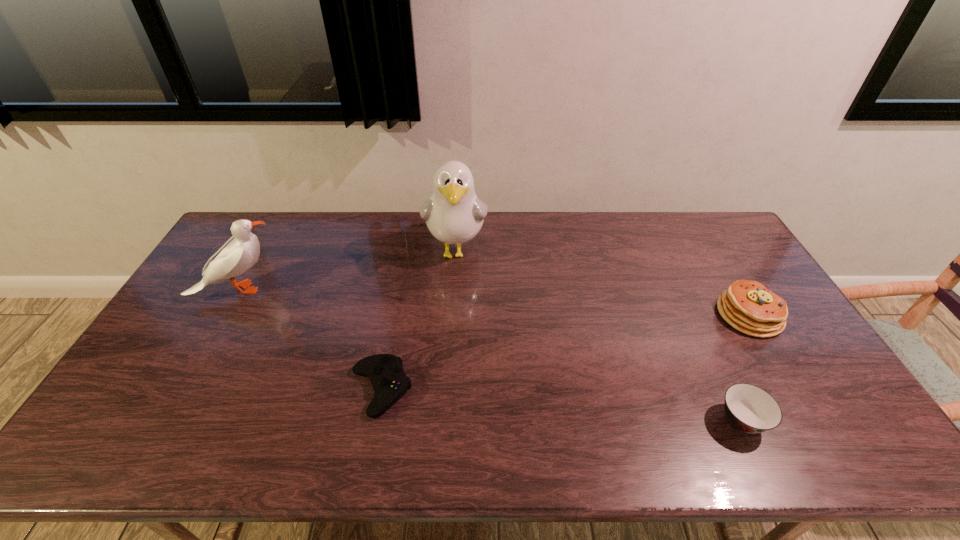
I want to click on free spot between the pancake and the shortest object, so click(564, 352).

The height and width of the screenshot is (540, 960). I want to click on free space between the second tallest object and the right gull, so click(348, 270).

You are a GUI agent. You are given a task and a screenshot of the screen. Output one action in this format:
    pyautogui.click(x=<x>, y=<y>)
    Task: Click on the free spot between the soup bowl and the shortest object
    The image size is (960, 540).
    Given the screenshot: What is the action you would take?
    pyautogui.click(x=562, y=405)

Point out which object is positioned as the second nearest to the tallest object. Please provide its 2D coordinates. Your answer should be formatted as a tuple, i.e. [(x, y)], where the tuple contains the x and y coordinates of a point satisfying the conditions above.

[(242, 250)]

Locate which object is the second closest to the shortest object. Please provide its 2D coordinates. Your answer should be formatted as a tuple, i.e. [(x, y)], where the tuple contains the x and y coordinates of a point satisfying the conditions above.

[(242, 250)]

Locate an element on the screen. This screenshot has width=960, height=540. vacant space that satisfies the following two spatial constraints: 1. on the back side of the control; 2. on the left side of the third tallest object is located at coordinates (395, 315).

Locate an element on the screen. Image resolution: width=960 pixels, height=540 pixels. blank space that satisfies the following two spatial constraints: 1. at the beak of the fourth object from left to right; 2. on the right side of the leftmost object is located at coordinates (164, 421).

This screenshot has height=540, width=960. Identify the location of free spot that satisfies the following two spatial constraints: 1. at the beak of the rightmost object; 2. on the right side of the leftmost object. (224, 315).

The height and width of the screenshot is (540, 960). I want to click on vacant area that satisfies the following two spatial constraints: 1. on the back side of the shortest object; 2. at the beak of the fourth shortest object, so click(x=399, y=289).

Locate an element on the screen. blank area in the image that satisfies the following two spatial constraints: 1. on the beak of the taller gull; 2. on the right side of the second shortest object is located at coordinates (445, 421).